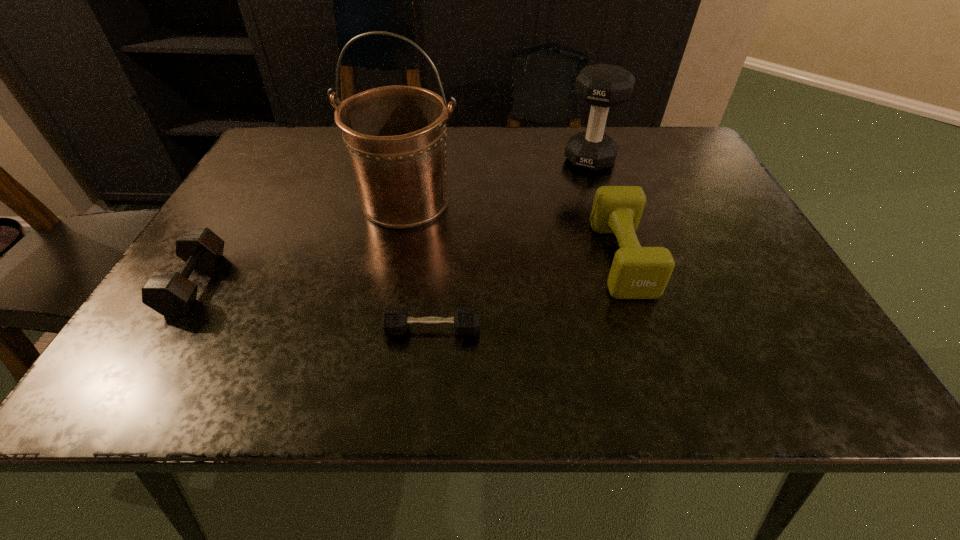
Locate an element on the screen. The height and width of the screenshot is (540, 960). object that stands as the third closest to the leftmost dumbbell is located at coordinates (637, 272).

Identify which dumbbell is the closest to the bucket. Please provide its 2D coordinates. Your answer should be formatted as a tuple, i.e. [(x, y)], where the tuple contains the x and y coordinates of a point satisfying the conditions above.

[(169, 293)]

I want to click on dumbbell identified as the fourth closest to the bucket, so click(x=637, y=272).

The image size is (960, 540). I want to click on vacant space that satisfies the following two spatial constraints: 1. on the front side of the shortest object; 2. on the left side of the leftmost dumbbell, so click(x=167, y=329).

The image size is (960, 540). In order to click on free space in the image that satisfies the following two spatial constraints: 1. on the back side of the tallest object; 2. on the left side of the tallest dumbbell in this screenshot , I will do `click(414, 160)`.

Where is `vacant space that satisfies the following two spatial constraints: 1. on the back side of the second shortest object; 2. on the right side of the tallest object`? vacant space that satisfies the following two spatial constraints: 1. on the back side of the second shortest object; 2. on the right side of the tallest object is located at coordinates (246, 201).